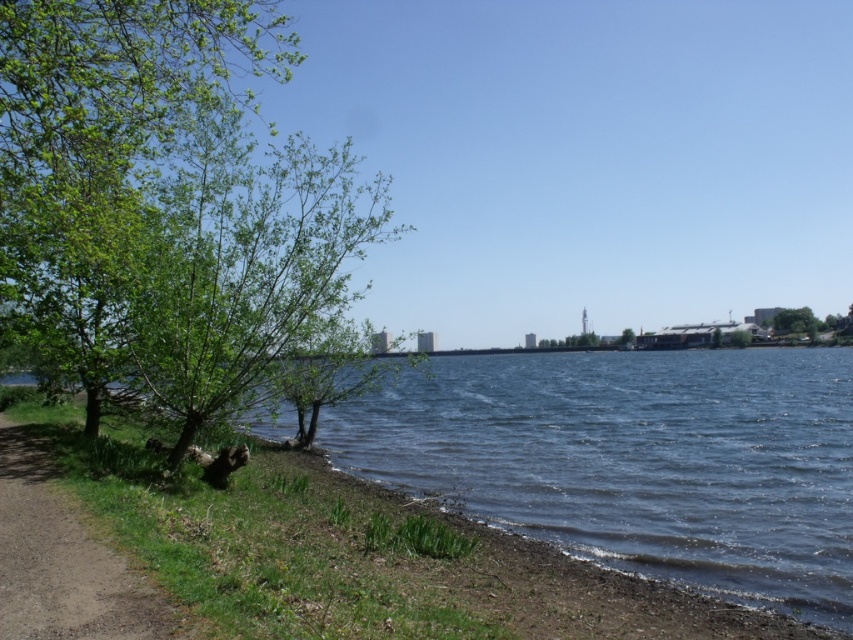
Question: Is dirt/gravel path at lower left wider than green leafy tree at upper right?

Choices:
 (A) no
 (B) yes

Answer: (A)

Question: Which point is farther to the camera?

Choices:
 (A) (9, 100)
 (B) (791, 317)

Answer: (B)

Question: Which of the following is the farthest from the observer?

Choices:
 (A) (793, 314)
 (B) (619, 342)
 (C) (315, 289)
 (D) (90, 568)

Answer: (B)

Question: Can you confirm if green leafy tree at left is wider than green leafy tree at center?

Choices:
 (A) no
 (B) yes

Answer: (B)

Question: Can you confirm if green leafy tree at left is thinner than green leafy tree at upper right?

Choices:
 (A) yes
 (B) no

Answer: (B)

Question: Based on their relative distances, which object is nearer to the green leafy tree at upper right?

Choices:
 (A) green leafy tree at center
 (B) dirt/gravel path at lower left
 (C) green leafy tree at left

Answer: (A)